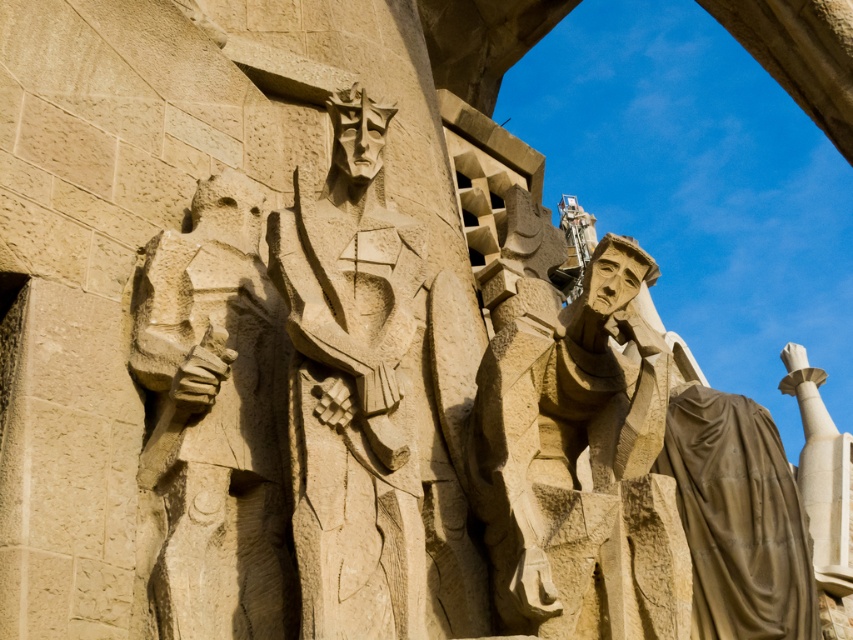
Between point (338, 330) and point (250, 536), which one is positioned in front?

Positioned in front is point (338, 330).

Is beige stone sculpture at center positioned at the back of carved stone figure at center?

No, it is not.

Where is `beige stone sculpture at center`? The height and width of the screenshot is (640, 853). beige stone sculpture at center is located at coordinates (367, 404).